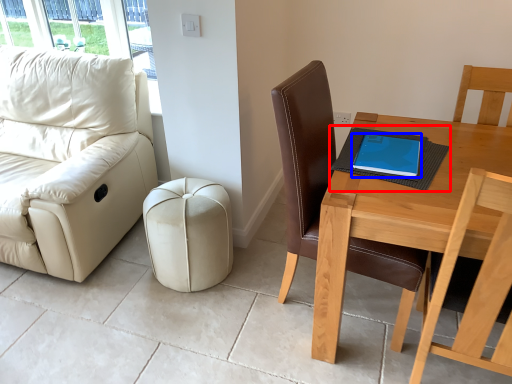
Question: Which object is further to the camera taking this photo, notebook (highlighted by a red box) or tablet computer (highlighted by a blue box)?

Choices:
 (A) notebook
 (B) tablet computer

Answer: (B)